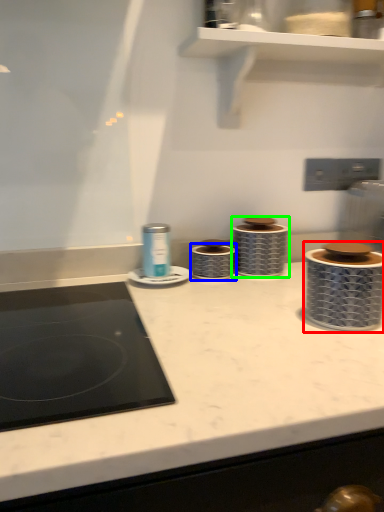
Question: Which object is the farthest from appliance (highlighted by a red box)? Choose among these: appliance (highlighted by a blue box) or appliance (highlighted by a green box).

Choices:
 (A) appliance
 (B) appliance

Answer: (A)